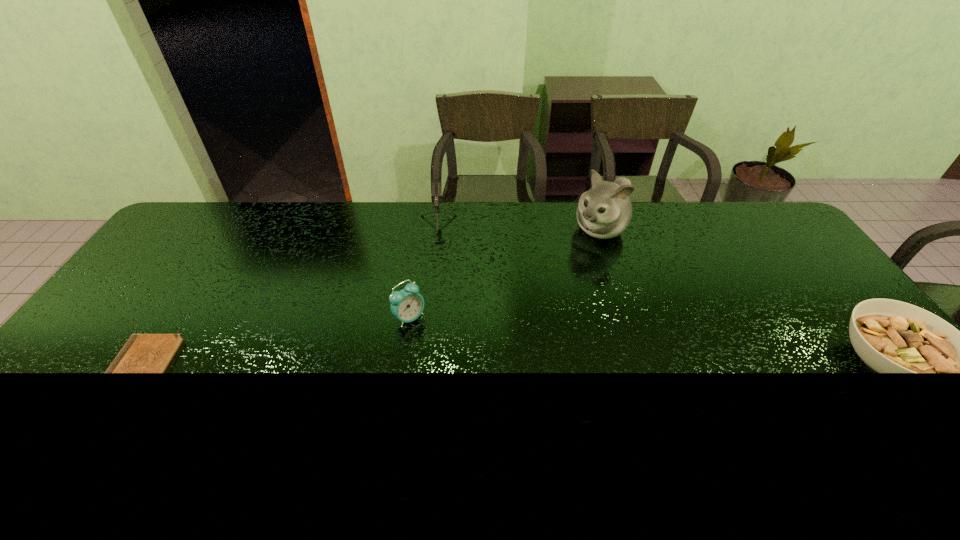
You are a GUI agent. You are given a task and a screenshot of the screen. Output one action in this format:
    pyautogui.click(x=<x>, y=<y>)
    Task: Click on the object present at the left edge
    The height and width of the screenshot is (540, 960).
    Given the screenshot: What is the action you would take?
    pyautogui.click(x=143, y=353)

I want to click on object present at the near left corner, so click(143, 353).

Locate an element on the screen. This screenshot has width=960, height=540. vacant space at the far edge of the desktop is located at coordinates (452, 221).

I want to click on free space at the near edge, so click(x=243, y=395).

This screenshot has width=960, height=540. I want to click on vacant space at the left edge, so coord(152,281).

Where is `vacant position at the right edge of the desktop`? This screenshot has height=540, width=960. vacant position at the right edge of the desktop is located at coordinates [836, 351].

Locate an element on the screen. The height and width of the screenshot is (540, 960). free region at the near right corner of the desktop is located at coordinates (931, 420).

I want to click on free spot between the diary and the microphone, so click(x=288, y=300).

Where is `free area in between the second object from right to left and the microphone`? free area in between the second object from right to left and the microphone is located at coordinates (517, 231).

At what (x,y) coordinates should I click in order to perform the action: click on vacant region between the alarm clock and the tallest object. Please return your answer as a coordinate pair (x, y). Image resolution: width=960 pixels, height=540 pixels. Looking at the image, I should click on (505, 274).